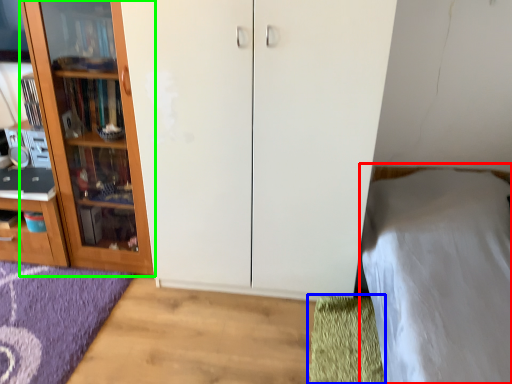
Question: Which object is positioned farthest from bed (highlighted by a red box)? Select from doormat (highlighted by a blue box) and cupboard (highlighted by a green box).

Choices:
 (A) doormat
 (B) cupboard

Answer: (B)